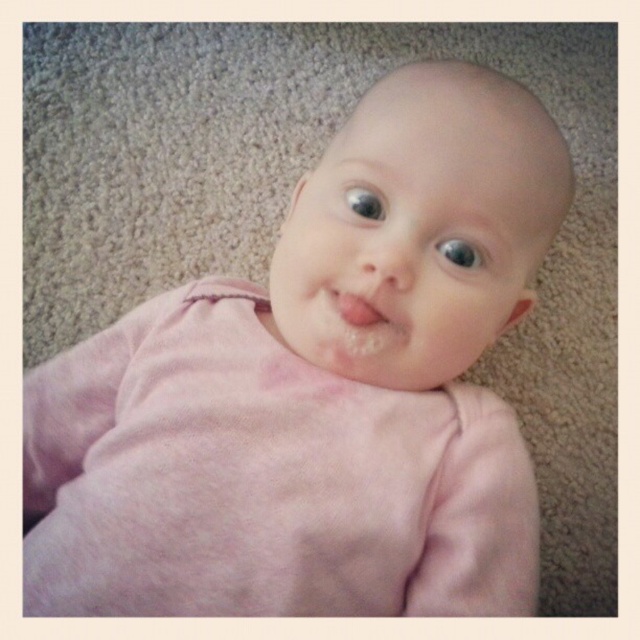
Looking at this image, you are a photographer taking a picture of a baby. You notice two points on the baby, one at point (292, 324) and another at point (360, 209). Which point is closer to the camera?

Point (292, 324) is further to the camera than point (360, 209), so the point closer to the camera is point (360, 209).

You are a photographer adjusting the focus on your camera. You need to ensure both the pink matte lips at center and the blue glossy eye at upper center are in focus. Which object should you focus on first to ensure the other is also in focus?

The blue glossy eye at upper center is located above the pink matte lips at center. Since they are close to each other vertically, focusing on the one in the middle of the two might ensure both are in focus. However, based on their positions, focusing on the blue glossy eye at upper center first would help capture the pink matte lips at center in focus as well due to their proximity.

You are a photographer adjusting your camera focus. You need to focus on two points in the image of the baby. The first point is point (358, 316) and the second is point (364, 196). Which point should you focus on first to ensure the baby is in focus?

You should focus on point (358, 316) first because it is closer to the viewer than point (364, 196), ensuring the baby is in focus.